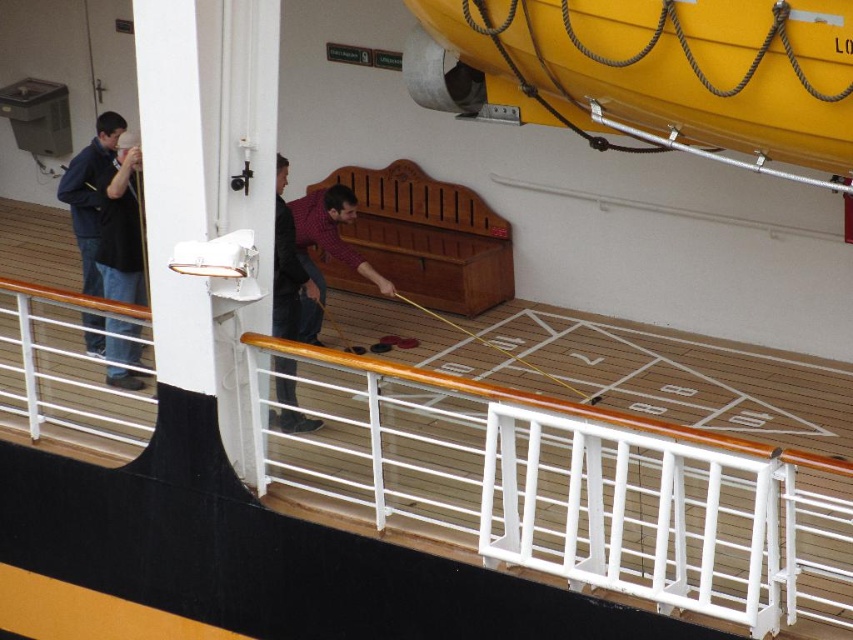
In the scene shown: Is black fabric shirt at left to the left of dark red shirt at center from the viewer's perspective?

Yes, black fabric shirt at left is to the left of dark red shirt at center.

Can you confirm if black fabric shirt at left is taller than dark red shirt at center?

Incorrect, black fabric shirt at left's height is not larger of dark red shirt at center's.

Where is `black fabric shirt at left`? This screenshot has width=853, height=640. black fabric shirt at left is located at coordinates (120, 227).

Where is `black fabric shirt at left`? The height and width of the screenshot is (640, 853). black fabric shirt at left is located at coordinates [120, 227].

How far apart are plaid shirt at center and dark red shirt at center?

The distance of plaid shirt at center from dark red shirt at center is 16.46 inches.

This screenshot has width=853, height=640. Describe the element at coordinates (326, 250) in the screenshot. I see `plaid shirt at center` at that location.

Find the location of a particular element. Image resolution: width=853 pixels, height=640 pixels. plaid shirt at center is located at coordinates (326, 250).

Can you confirm if black fabric shirt at left is positioned below plaid shirt at center?

No, black fabric shirt at left is not below plaid shirt at center.

Which of these two, black fabric shirt at left or plaid shirt at center, stands shorter?

Standing shorter between the two is black fabric shirt at left.

Does point (138, 275) come closer to viewer compared to point (379, 275)?

Yes, it is.

Find the location of a particular element. black fabric shirt at left is located at coordinates (120, 227).